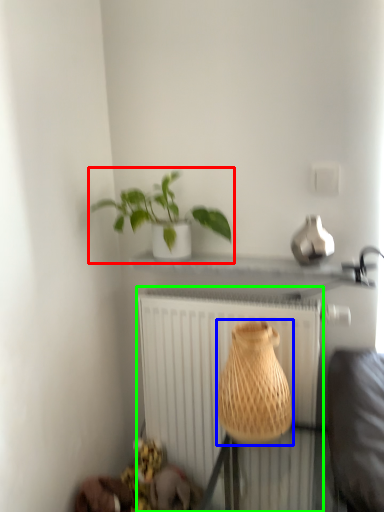
Question: Estimate the real-world distances between objects in this image. Which object is closer to houseplant (highlighted by a red box), vase (highlighted by a blue box) or radiator (highlighted by a green box)?

Choices:
 (A) vase
 (B) radiator

Answer: (B)